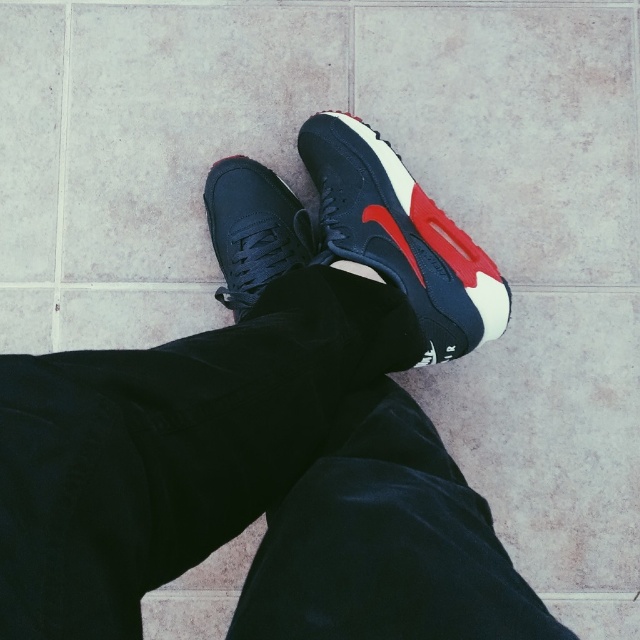
Question: Is white matte tile at upper left in front of matte black sneaker at center?

Choices:
 (A) yes
 (B) no

Answer: (B)

Question: Which object appears closest to the camera in this image?

Choices:
 (A) white matte tile at upper left
 (B) matte rubber shoe at center
 (C) matte black shoe at center
 (D) white soft sock at center

Answer: (D)

Question: Is matte black sneaker at center thinner than white soft sock at center?

Choices:
 (A) yes
 (B) no

Answer: (B)

Question: From the image, what is the correct spatial relationship of matte leather sneaker at center in relation to white matte tile at upper left?

Choices:
 (A) above
 (B) below

Answer: (B)

Question: Which of the following is the closest to the observer?

Choices:
 (A) (586, 118)
 (B) (406, 280)

Answer: (B)

Question: Among these points, which one is farthest from the camera?

Choices:
 (A) (51, 106)
 (B) (280, 244)
 (C) (337, 266)

Answer: (A)